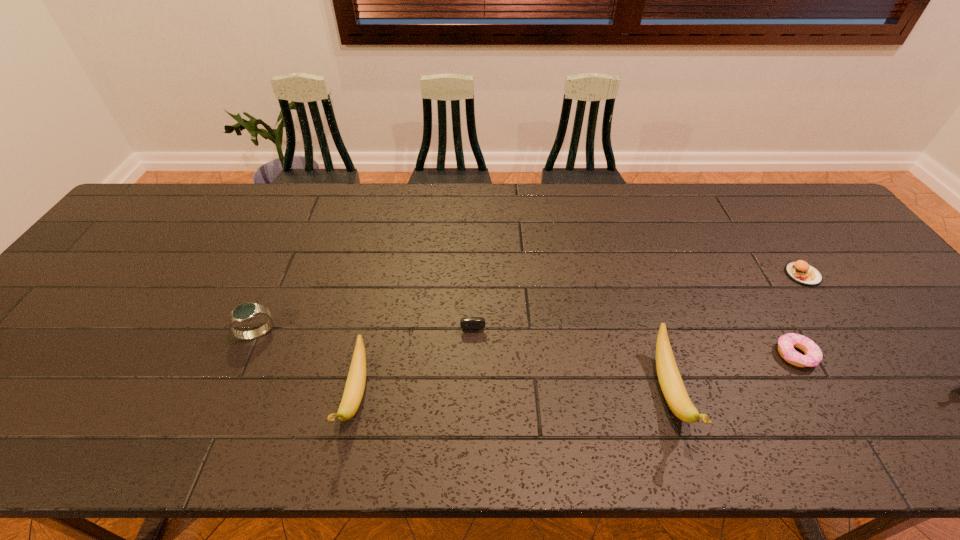
This screenshot has height=540, width=960. I want to click on the fifth shortest object, so click(x=354, y=389).

Locate an element on the screen. Image resolution: width=960 pixels, height=540 pixels. the left banana is located at coordinates (354, 389).

Find the location of a particular element. the right banana is located at coordinates (672, 386).

Find the location of a particular element. Image resolution: width=960 pixels, height=540 pixels. webcam is located at coordinates (468, 322).

Where is `the rightmost object`? This screenshot has height=540, width=960. the rightmost object is located at coordinates (801, 272).

The height and width of the screenshot is (540, 960). Find the location of `watch`. watch is located at coordinates (245, 312).

Locate an element on the screen. This screenshot has width=960, height=540. the leftmost object is located at coordinates (245, 312).

Find the location of a particular element. The height and width of the screenshot is (540, 960). doughnut is located at coordinates click(813, 356).

At what (x,y) coordinates should I click in order to perform the action: click on the shortest object. Please return your answer as a coordinate pair (x, y). This screenshot has height=540, width=960. Looking at the image, I should click on (813, 356).

What are the coordinates of `free space located 0.060m on the front-facing side of the webcam` in the screenshot? It's located at (468, 354).